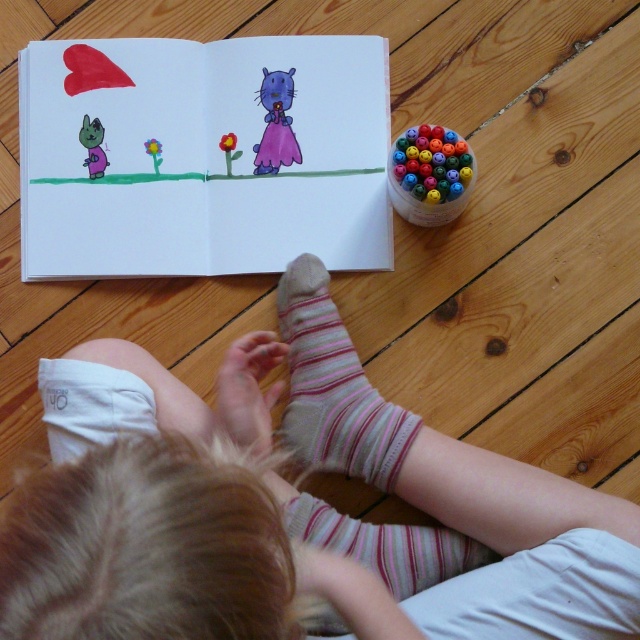
You are a photographer taking a picture of the drawing in the notebook. You want to focus on the point at coordinates point (x=412, y=131) and point (x=90, y=173). Which point should you focus on first to ensure both are in sharp focus?

You should focus on point (x=412, y=131) first because it is closer to the viewer than point (x=90, y=173), ensuring both points will be in focus when using the correct depth of field.

The child is drawing a scene with a purple matte dress at upper center and a smooth red flower at center. Which object in the drawing is positioned higher?

The purple matte dress at upper center is positioned higher than the smooth red flower at center.

In the scene shown: Based on the scene described, where is the striped cotton sock at lower center located in relation to the purple matte dress at upper center?

The striped cotton sock at lower center is to the right of the purple matte dress at upper center.